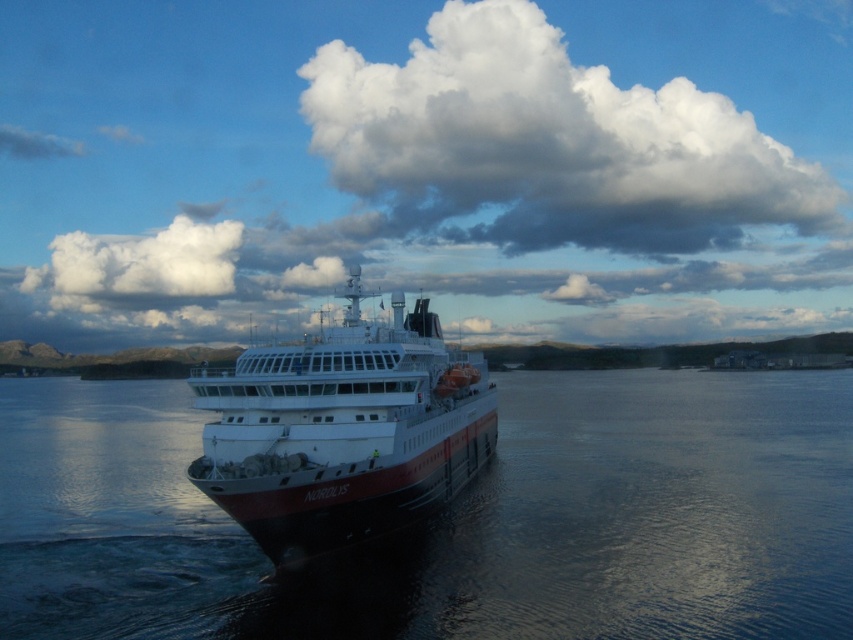
Question: Which point is farther from the camera taking this photo?

Choices:
 (A) (656, 237)
 (B) (271, 520)

Answer: (A)

Question: Among these points, which one is nearest to the camera?

Choices:
 (A) (340, 42)
 (B) (62, 588)
 (C) (379, 518)

Answer: (B)

Question: Which point is farther from the camera taking this photo?

Choices:
 (A) (416, 60)
 (B) (355, 438)
 (C) (643, 465)

Answer: (A)

Question: Considering the relative positions of white fluffy cloud at upper center and white glossy ship at center in the image provided, where is white fluffy cloud at upper center located with respect to white glossy ship at center?

Choices:
 (A) above
 (B) below

Answer: (A)

Question: Observing the image, what is the correct spatial positioning of white fluffy cloud at upper center in reference to white glossy ship at center?

Choices:
 (A) above
 (B) below

Answer: (A)

Question: Does glossy water at center appear on the right side of white glossy ship at center?

Choices:
 (A) no
 (B) yes

Answer: (B)